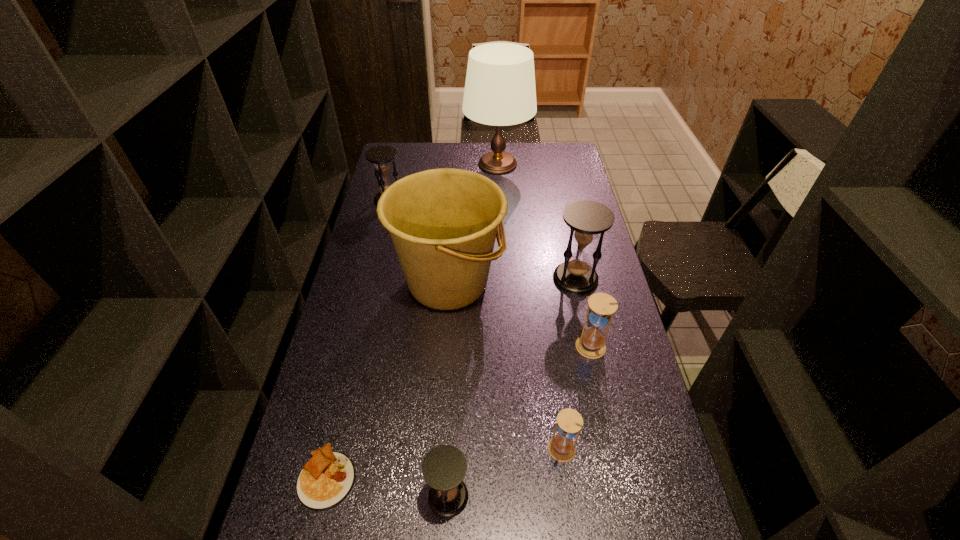
In order to click on blank space located 0.110m on the right of the fourth farthest hourglass in this screenshot , I will do `click(620, 450)`.

What are the coordinates of `blank space located on the right of the omelet` in the screenshot? It's located at (495, 477).

Locate an element on the screen. This screenshot has width=960, height=540. object located at the far edge is located at coordinates (500, 90).

Where is `bucket present at the left edge`? The height and width of the screenshot is (540, 960). bucket present at the left edge is located at coordinates (443, 223).

Find the location of a particular element. Image resolution: width=960 pixels, height=540 pixels. hourglass present at the left edge is located at coordinates (381, 156).

Where is `omelet present at the left edge`? The image size is (960, 540). omelet present at the left edge is located at coordinates (325, 481).

Find the location of a particular element. The height and width of the screenshot is (540, 960). free location at the left edge is located at coordinates (377, 259).

This screenshot has height=540, width=960. I want to click on vacant position at the far left corner of the desktop, so click(413, 169).

In the image, there is a desktop. Where is `free space at the far right corner`? Image resolution: width=960 pixels, height=540 pixels. free space at the far right corner is located at coordinates (540, 153).

Find the location of a particular element. This screenshot has width=960, height=540. vacant area that lies between the leftmost black hourglass and the nearer white hourglass is located at coordinates (475, 325).